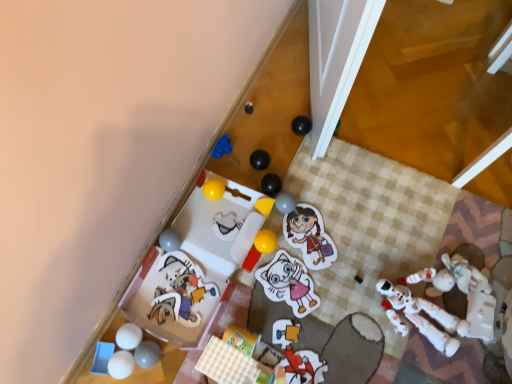
In order to click on free space that is in between yellow matte block at upper center, which is the fifth toy in right-to-left order, and white matte cat at center, placed as the fourteenth toy when sorted from left to right in this screenshot , I will do `click(277, 243)`.